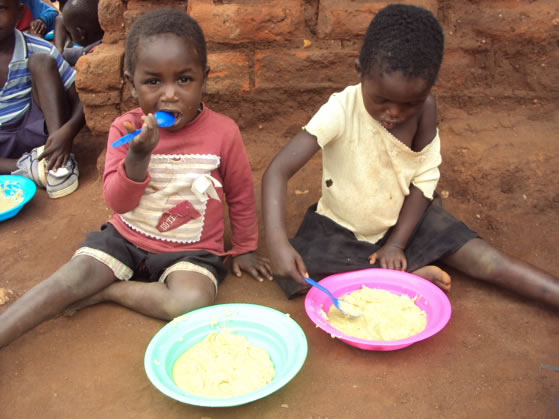
The image size is (559, 419). What are the coordinates of `food in the plate` in the screenshot? It's located at [x=395, y=306], [x=240, y=356].